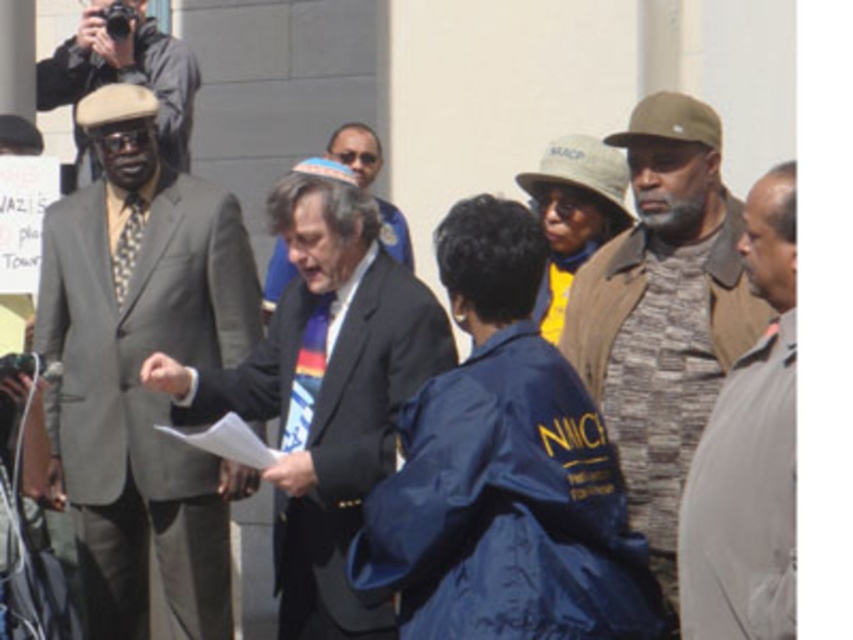
How distant is camouflage jacket at right from camouflage fabric hat at center?

They are 3.92 meters apart.

Is camouflage jacket at right thinner than camouflage fabric hat at center?

Incorrect, camouflage jacket at right's width is not less than camouflage fabric hat at center's.

The height and width of the screenshot is (640, 853). What do you see at coordinates (663, 310) in the screenshot?
I see `camouflage jacket at right` at bounding box center [663, 310].

Identify the location of camouflage jacket at right. This screenshot has width=853, height=640. (663, 310).

Can you confirm if camouflage fabric hat at center is taller than matte black suit at center?

No, camouflage fabric hat at center is not taller than matte black suit at center.

Describe the element at coordinates (573, 212) in the screenshot. I see `camouflage fabric hat at center` at that location.

Is point (611, 234) in front of point (341, 145)?

Yes, it is in front of point (341, 145).

This screenshot has width=853, height=640. Find the location of `camouflage fabric hat at center`. camouflage fabric hat at center is located at coordinates (573, 212).

Can you confirm if gray suit at left is thinner than patterned silk tie at left?

No.

Can you confirm if gray suit at left is smaller than patterned silk tie at left?

Incorrect, gray suit at left is not smaller in size than patterned silk tie at left.

From the picture: Who is more forward, (97,392) or (132,216)?

Point (97,392) is in front.

Where is `gray suit at left`? This screenshot has height=640, width=853. gray suit at left is located at coordinates (138, 372).